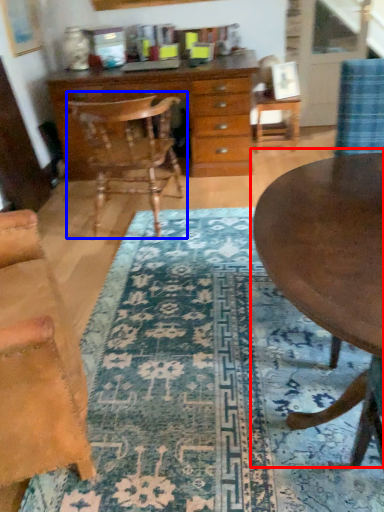
Question: Which object appears farthest to the camera in this image, coffee table (highlighted by a red box) or chair (highlighted by a blue box)?

Choices:
 (A) coffee table
 (B) chair

Answer: (B)